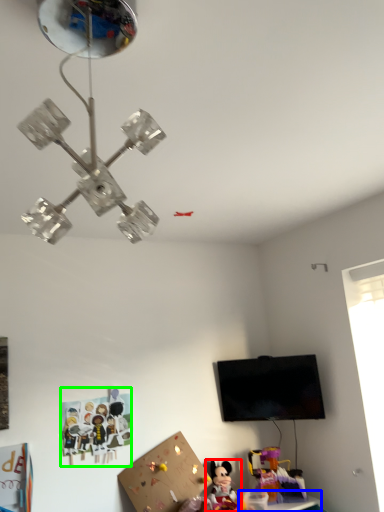
Question: Which object is the farthest from toy (highlighted by a red box)? Choose among these: table (highlighted by a blue box) or toy (highlighted by a green box).

Choices:
 (A) table
 (B) toy

Answer: (B)